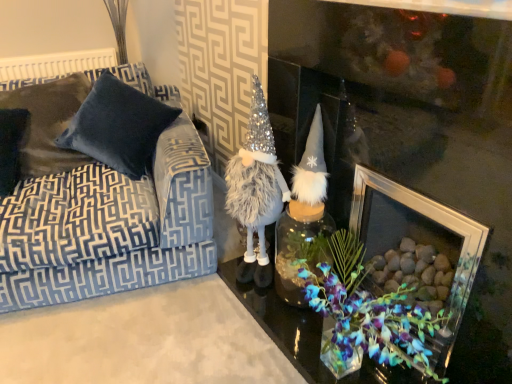
At what (x,y) coordinates should I click in order to perform the action: click on free space to the left of fuzzy silver/grey gnome at center. Please return your answer as a coordinate pair (x, y). Looking at the image, I should click on click(x=203, y=289).